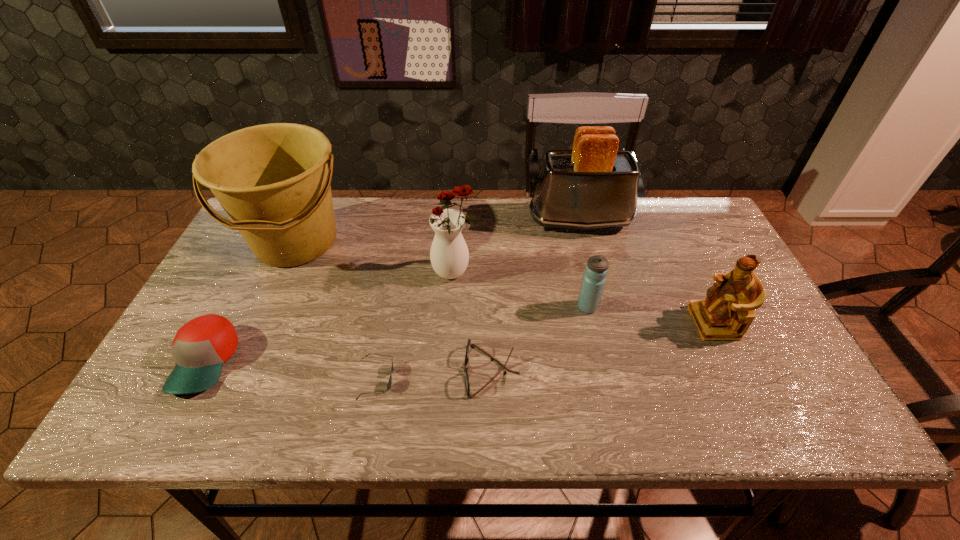
Identify the location of free space that is in between the spectacles and the fourth shortest object. The height and width of the screenshot is (540, 960). pyautogui.click(x=540, y=339).

Where is `vacant area that lies between the second shortest object and the water bottle`? The width and height of the screenshot is (960, 540). vacant area that lies between the second shortest object and the water bottle is located at coordinates 540,339.

Image resolution: width=960 pixels, height=540 pixels. In order to click on free spot between the seventh tallest object and the baseball cap in this screenshot , I will do `click(348, 366)`.

This screenshot has width=960, height=540. I want to click on vacant area that lies between the bucket and the vase, so click(375, 256).

Locate an element on the screen. unoccupied position between the vase and the toaster is located at coordinates (516, 246).

Find the location of a particular element. free point between the vase and the bucket is located at coordinates (375, 256).

You are a GUI agent. You are given a task and a screenshot of the screen. Output one action in this format:
    pyautogui.click(x=<x>, y=<y>)
    Task: Click on the vacant region between the baseball cap and the bucket
    
    Given the screenshot: What is the action you would take?
    [252, 302]

Image resolution: width=960 pixels, height=540 pixels. What are the coordinates of `free space between the baseball cap and the water bottle` in the screenshot? It's located at (396, 334).

Where is `object that is the second closest to the bucket`? This screenshot has height=540, width=960. object that is the second closest to the bucket is located at coordinates (449, 255).

Find the location of `object that stands as the fourth closest to the bucket`. object that stands as the fourth closest to the bucket is located at coordinates (467, 383).